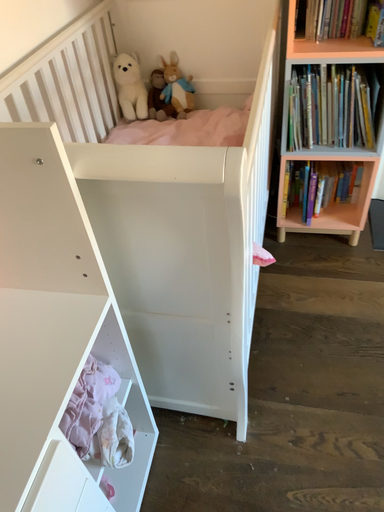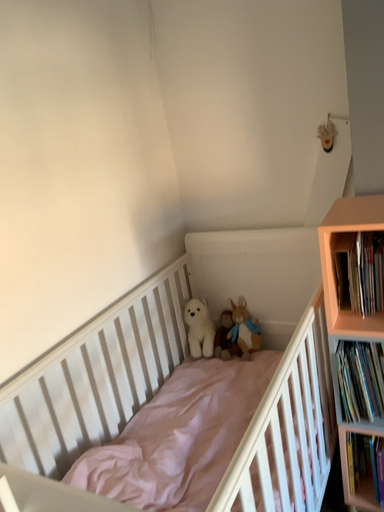
Question: How did the camera likely rotate when shooting the video?

Choices:
 (A) rotated right
 (B) rotated left

Answer: (B)